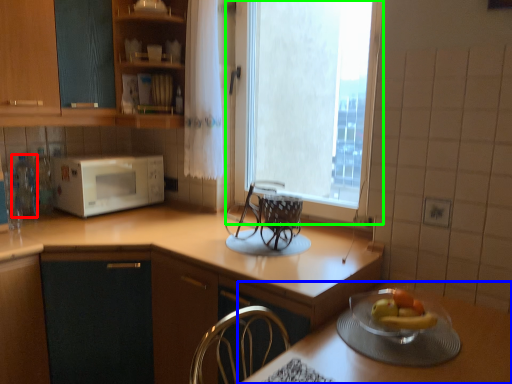
Question: Based on their relative distances, which object is farther from bottle (highlighted by a red box)? Choose from table (highlighted by a blue box) and window (highlighted by a green box).

Choices:
 (A) table
 (B) window

Answer: (B)